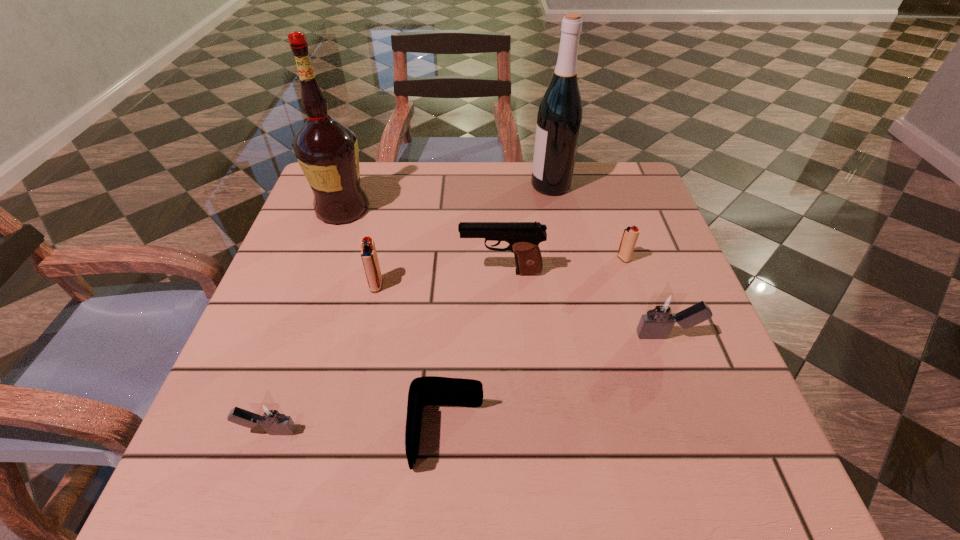
Find the location of `igniter that is positioned at the left edge`. igniter that is positioned at the left edge is located at coordinates (269, 414).

Identify the location of object located at the far left corner. (327, 151).

Locate an element on the screen. Image resolution: width=960 pixels, height=540 pixels. object at the near left corner is located at coordinates (269, 414).

Locate an element on the screen. Image resolution: width=960 pixels, height=540 pixels. vacant space at the far edge of the desktop is located at coordinates (x=378, y=201).

What are the coordinates of `free region at the near edge of the desktop` in the screenshot? It's located at (501, 437).

At what (x,y) coordinates should I click in order to perform the action: click on free region at the left edge of the desktop. Please return your answer as a coordinate pair (x, y). Looking at the image, I should click on (331, 232).

The height and width of the screenshot is (540, 960). I want to click on free space at the right edge, so click(x=684, y=353).

The image size is (960, 540). What are the coordinates of `vacant space at the near left corner of the desktop` in the screenshot? It's located at coord(300,456).

In the image, there is a desktop. Identify the location of vacant space at the far right corner. (620, 184).

The height and width of the screenshot is (540, 960). Identify the location of unoccupied position between the smaller gray igniter and the fourth nearest object. (323, 358).